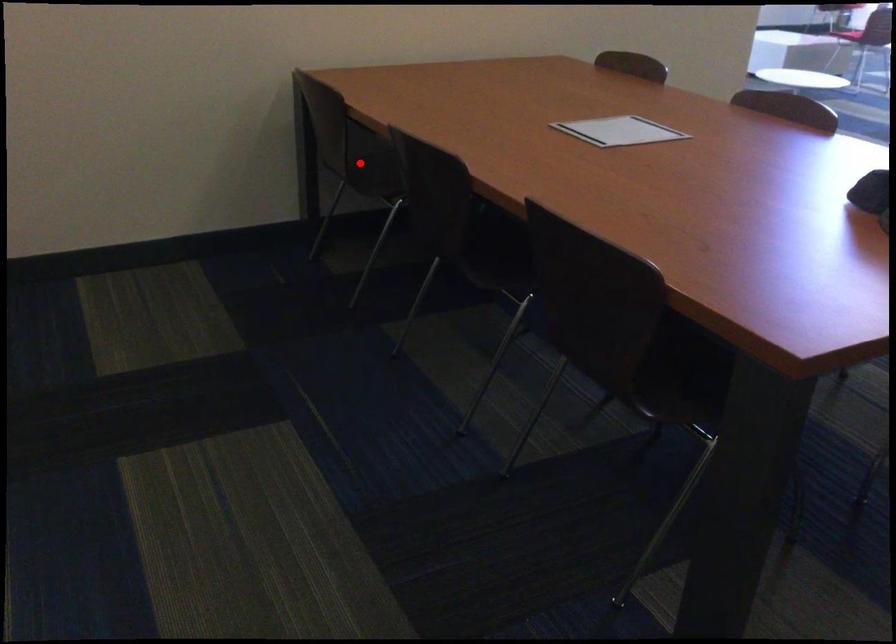
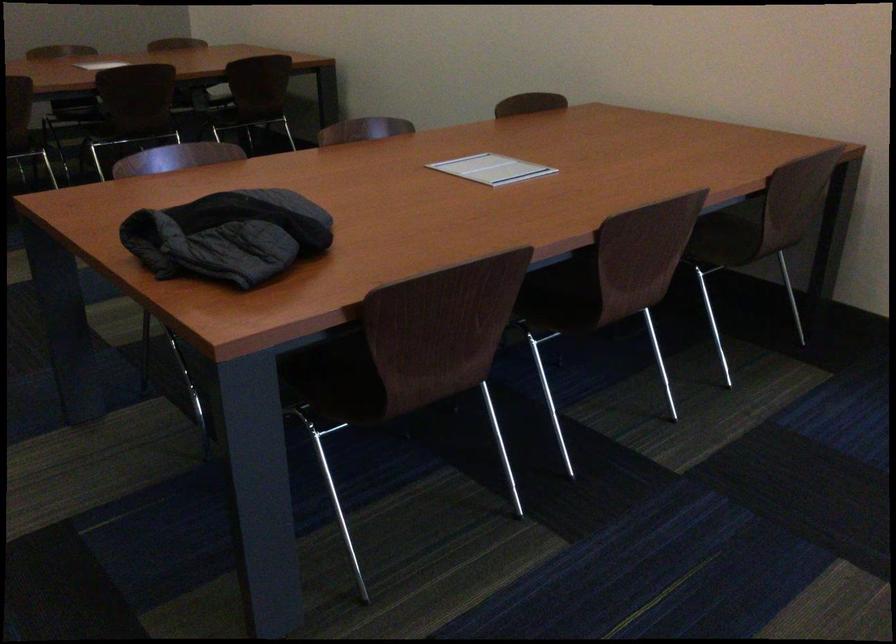
Question: I am providing you with two images of the same scene from different viewpoints. A red point is marked on the first image. Can you still see the location of the red point in image 2?

Choices:
 (A) Yes
 (B) No

Answer: (B)